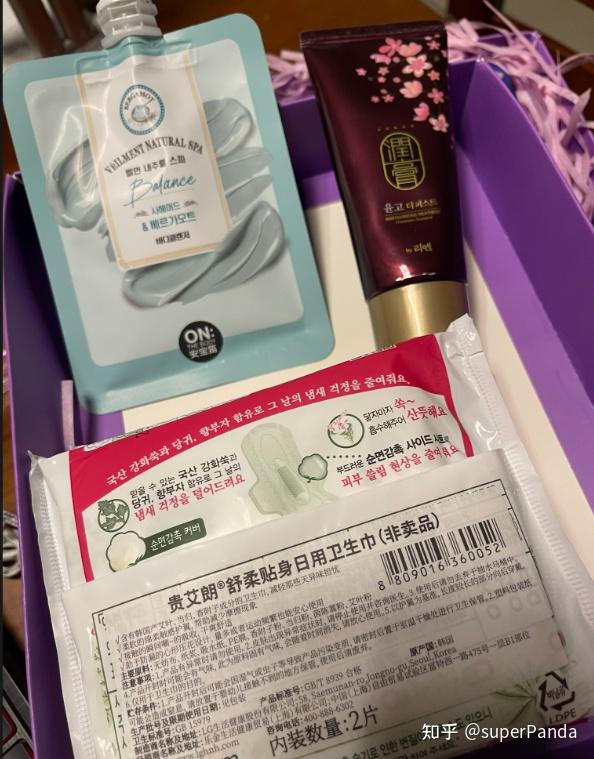
Locate an element on the screen. The width and height of the screenshot is (594, 759). table is located at coordinates (307, 17).